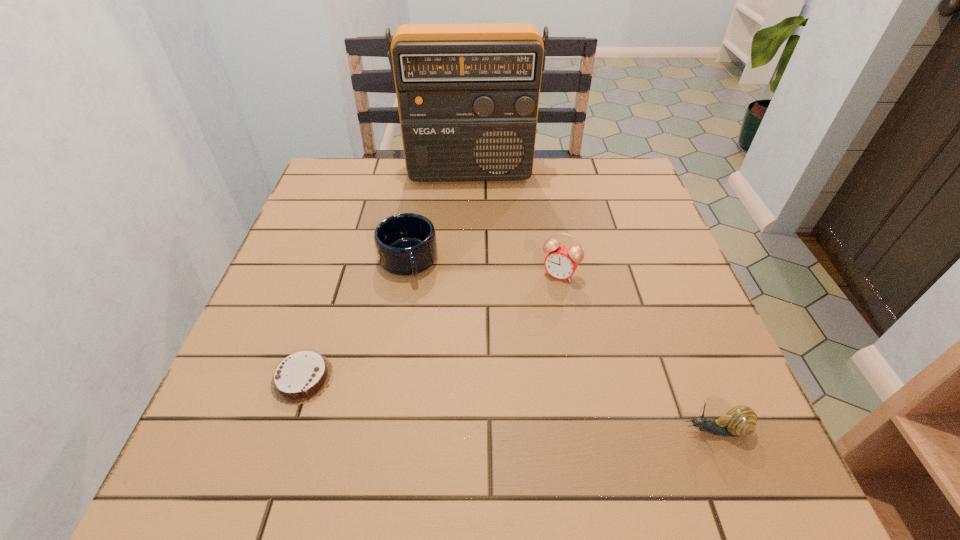
Identify the location of vacant space on the desktop that is between the second nearest object and the nearest object and is positioned on the front-facing side of the radio receiver. This screenshot has height=540, width=960. (474, 400).

I want to click on vacant spot on the desktop that is between the shortest object and the second shortest object and is positioned on the clock face of the second tallest object, so click(x=489, y=401).

I want to click on vacant spot on the desktop that is between the fourth farthest object and the second shortest object and is positioned with the handle on the side of the mug, so click(x=449, y=396).